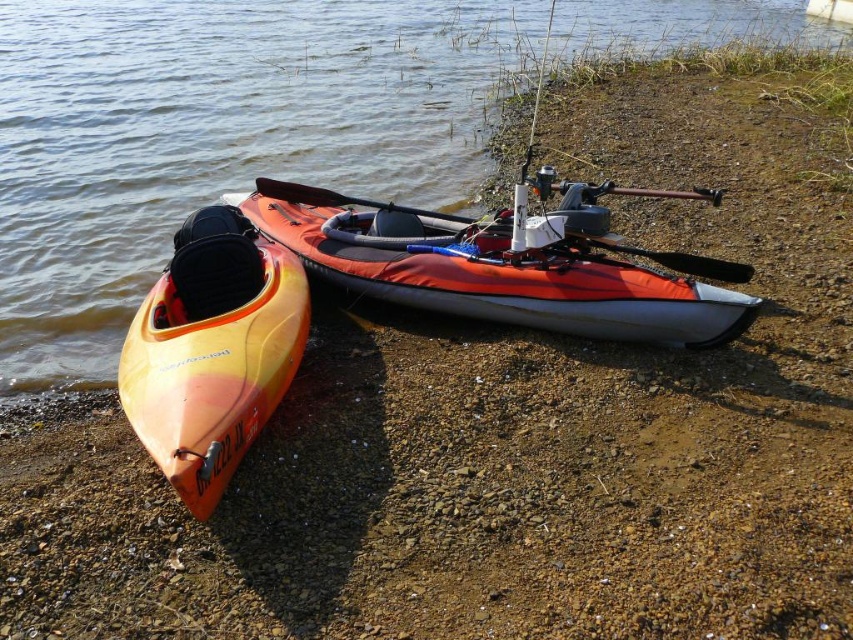
Who is lower down, orange kayak at lower left or orange matte kayak at left?

orange matte kayak at left

Does orange kayak at lower left have a greater height compared to orange matte kayak at left?

Yes, orange kayak at lower left is taller than orange matte kayak at left.

You are a GUI agent. You are given a task and a screenshot of the screen. Output one action in this format:
    pyautogui.click(x=<x>, y=<y>)
    Task: Click on the orange kayak at lower left
    
    Given the screenshot: What is the action you would take?
    pyautogui.click(x=213, y=136)

Is orange kayak at lower left wider than orange fabric canoe at center?

Correct, the width of orange kayak at lower left exceeds that of orange fabric canoe at center.

Does orange kayak at lower left have a lesser width compared to orange fabric canoe at center?

Incorrect, orange kayak at lower left's width is not less than orange fabric canoe at center's.

The height and width of the screenshot is (640, 853). In order to click on orange kayak at lower left in this screenshot , I will do click(213, 136).

Is orange fabric canoe at center wider than orange matte kayak at left?

Indeed, orange fabric canoe at center has a greater width compared to orange matte kayak at left.

Which is below, orange fabric canoe at center or orange matte kayak at left?

orange matte kayak at left

Who is more distant from viewer, [593,214] or [152,321]?

The point [593,214] is more distant.

Locate an element on the screen. The image size is (853, 640). orange fabric canoe at center is located at coordinates (508, 262).